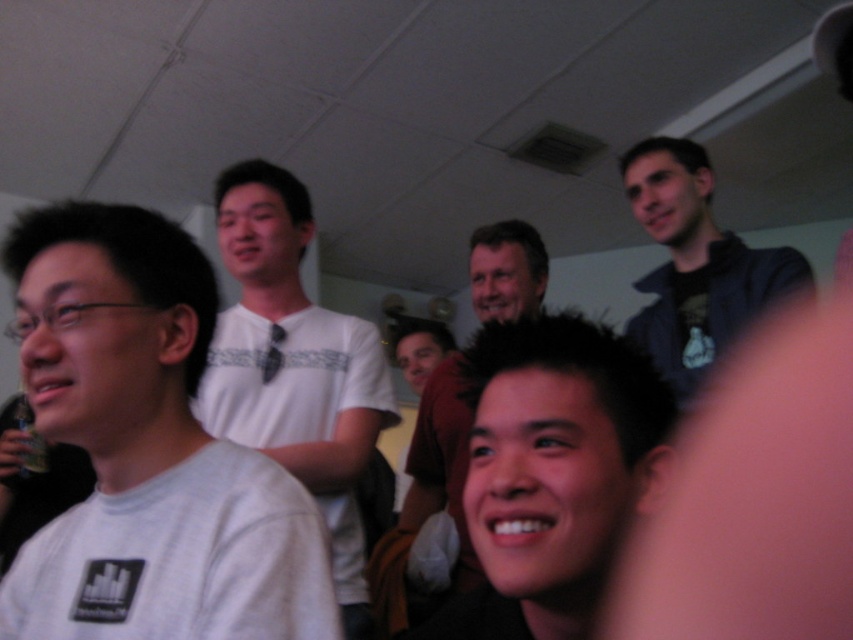
Question: Which point is closer to the camera taking this photo?

Choices:
 (A) (331, 477)
 (B) (451, 371)

Answer: (A)

Question: Is white matte shirt at center to the left of smooth skin face at center from the viewer's perspective?

Choices:
 (A) no
 (B) yes

Answer: (B)

Question: Does white matte shirt at left appear under dark blue jacket at upper right?

Choices:
 (A) no
 (B) yes

Answer: (B)

Question: Is white matte shirt at left to the left of smooth skin face at center from the viewer's perspective?

Choices:
 (A) no
 (B) yes

Answer: (B)

Question: Which of the following is the closest to the observer?

Choices:
 (A) (461, 540)
 (B) (354, 410)

Answer: (B)

Question: Which of the following is the closest to the observer?

Choices:
 (A) (404, 616)
 (B) (260, 340)
 (C) (706, 353)

Answer: (B)